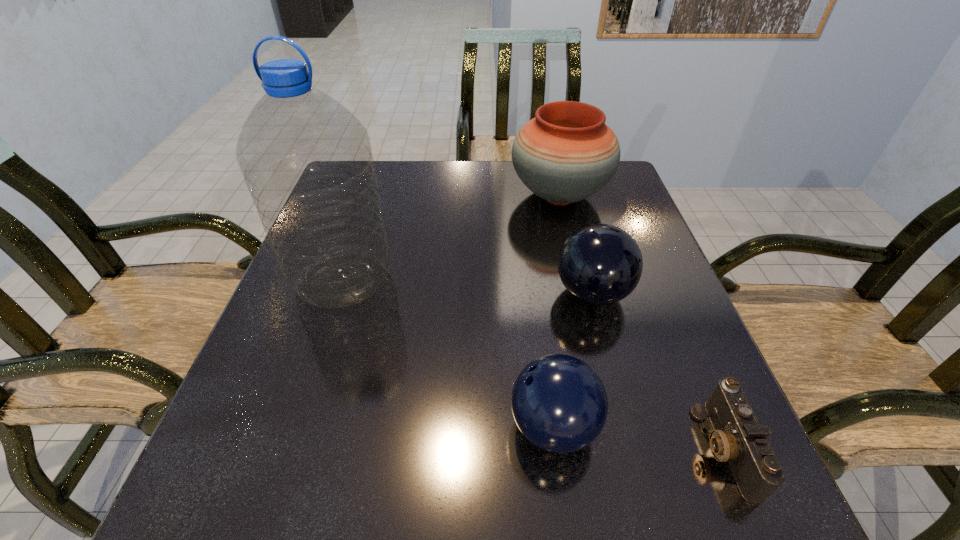
You are a GUI agent. You are given a task and a screenshot of the screen. Output one action in this format:
    pyautogui.click(x=<x>, y=<y>)
    Task: Click on the object located at the left edge
    This screenshot has width=960, height=540.
    Given the screenshot: What is the action you would take?
    pyautogui.click(x=307, y=161)

This screenshot has height=540, width=960. I want to click on pottery that is at the right edge, so click(x=567, y=153).

At what (x,y) coordinates should I click in order to perform the action: click on bowling ball that is at the right edge. Please return your answer as a coordinate pair (x, y). The height and width of the screenshot is (540, 960). Looking at the image, I should click on (600, 264).

The width and height of the screenshot is (960, 540). What are the coordinates of `camera located in the right edge section of the desktop` in the screenshot? It's located at (738, 438).

The image size is (960, 540). I want to click on object at the far right corner, so click(x=567, y=153).

Locate an element on the screen. The height and width of the screenshot is (540, 960). object positioned at the near right corner is located at coordinates (738, 438).

At what (x,y) coordinates should I click in order to perform the action: click on vacant space at the far edge of the desktop. Please return your answer as a coordinate pair (x, y). Image resolution: width=960 pixels, height=540 pixels. Looking at the image, I should click on (508, 186).

In order to click on vacant space at the left edge of the desktop in this screenshot , I will do `click(232, 398)`.

At what (x,y) coordinates should I click in order to perform the action: click on vacant space at the right edge. Please return your answer as a coordinate pair (x, y). Looking at the image, I should click on click(x=670, y=311).

You are a GUI agent. You are given a task and a screenshot of the screen. Output one action in this format:
    pyautogui.click(x=<x>, y=<y>)
    Task: Click on the free space at the near right corner
    This screenshot has width=960, height=540.
    Given the screenshot: What is the action you would take?
    pyautogui.click(x=663, y=499)